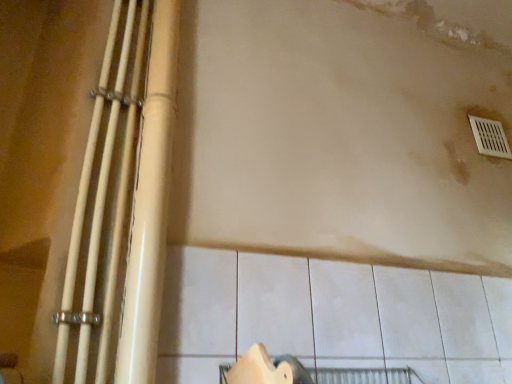
Question: Is the position of matte beige pipes at left, which is counted as the second beam, starting from the left, less distant than that of white plastic vent at upper right?

Choices:
 (A) no
 (B) yes

Answer: (B)

Question: Is matte beige pipes at left, which is counted as the second beam, starting from the left, smaller than white plastic vent at upper right?

Choices:
 (A) yes
 (B) no

Answer: (B)

Question: From the image's perspective, does matte beige pipes at left, the first beam positioned from the right, appear lower than white plastic vent at upper right?

Choices:
 (A) no
 (B) yes

Answer: (B)

Question: Could you tell me if matte beige pipes at left, the first beam positioned from the right, is facing white plastic vent at upper right?

Choices:
 (A) yes
 (B) no

Answer: (B)

Question: Is matte beige pipes at left, which is counted as the second beam, starting from the left, next to white plastic vent at upper right?

Choices:
 (A) no
 (B) yes

Answer: (A)

Question: Considering the relative positions of matte beige pipes at left, the first beam positioned from the right, and white plastic vent at upper right in the image provided, is matte beige pipes at left, the first beam positioned from the right, to the left of white plastic vent at upper right from the viewer's perspective?

Choices:
 (A) no
 (B) yes

Answer: (B)

Question: Considering the relative sizes of white glossy pipes at left, positioned as the first beam in left-to-right order, and matte beige pipes at left, which is counted as the second beam, starting from the left, in the image provided, is white glossy pipes at left, positioned as the first beam in left-to-right order, taller than matte beige pipes at left, which is counted as the second beam, starting from the left,?

Choices:
 (A) yes
 (B) no

Answer: (B)

Question: Can you confirm if white glossy pipes at left, positioned as the first beam in left-to-right order, is wider than matte beige pipes at left, which is counted as the second beam, starting from the left?

Choices:
 (A) yes
 (B) no

Answer: (B)

Question: Is white glossy pipes at left, positioned as the first beam in left-to-right order, touching matte beige pipes at left, which is counted as the second beam, starting from the left?

Choices:
 (A) no
 (B) yes

Answer: (B)

Question: Does white glossy pipes at left, the 2th beam viewed from the right, have a larger size compared to matte beige pipes at left, which is counted as the second beam, starting from the left?

Choices:
 (A) yes
 (B) no

Answer: (B)

Question: Would you say white glossy pipes at left, the 2th beam viewed from the right, is outside matte beige pipes at left, which is counted as the second beam, starting from the left?

Choices:
 (A) no
 (B) yes

Answer: (B)

Question: From a real-world perspective, is white glossy pipes at left, positioned as the first beam in left-to-right order, positioned over matte beige pipes at left, which is counted as the second beam, starting from the left, based on gravity?

Choices:
 (A) yes
 (B) no

Answer: (B)

Question: Is white plastic vent at upper right wider than white glossy pipes at left, positioned as the first beam in left-to-right order?

Choices:
 (A) yes
 (B) no

Answer: (B)